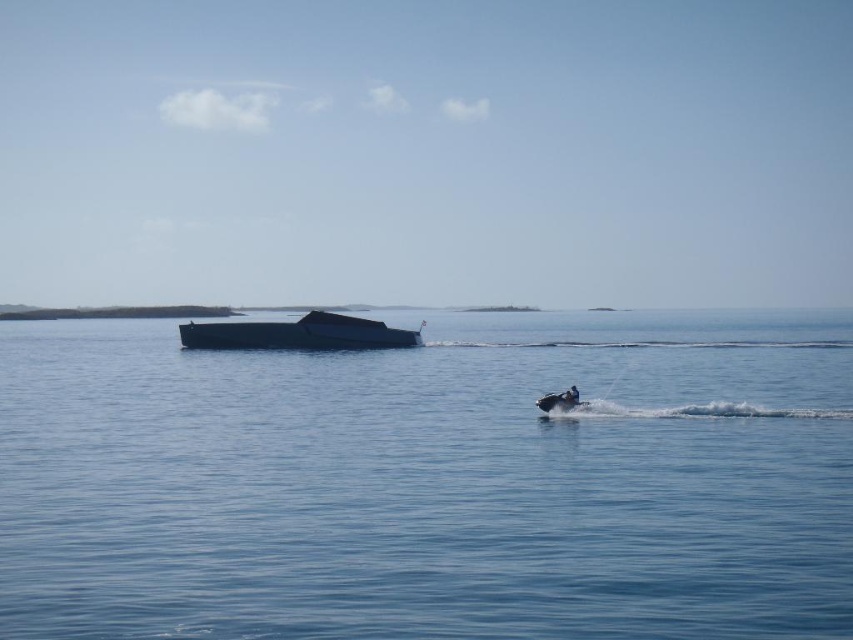
Question: Among these objects, which one is farthest from the camera?

Choices:
 (A) shiny black boat at center
 (B) dark blue fabric person at lower right
 (C) blue water at center
 (D) shiny black jet ski at center

Answer: (A)

Question: Which of the following is the farthest from the observer?

Choices:
 (A) dark blue fabric person at lower right
 (B) shiny black jet ski at center
 (C) shiny black boat at center
 (D) blue water at center

Answer: (C)

Question: Is the position of blue water at center more distant than that of shiny black boat at center?

Choices:
 (A) no
 (B) yes

Answer: (A)

Question: Is shiny black boat at center behind dark blue fabric person at lower right?

Choices:
 (A) no
 (B) yes

Answer: (B)

Question: Which object is positioned closest to the shiny black jet ski at center?

Choices:
 (A) shiny black boat at center
 (B) dark blue fabric person at lower right

Answer: (B)

Question: From the image, what is the correct spatial relationship of blue water at center in relation to shiny black boat at center?

Choices:
 (A) above
 (B) below

Answer: (B)